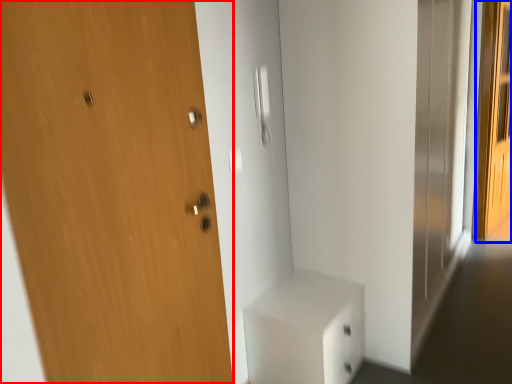
Question: Which point is further to the camera, door (highlighted by a red box) or screen door (highlighted by a blue box)?

Choices:
 (A) door
 (B) screen door

Answer: (B)